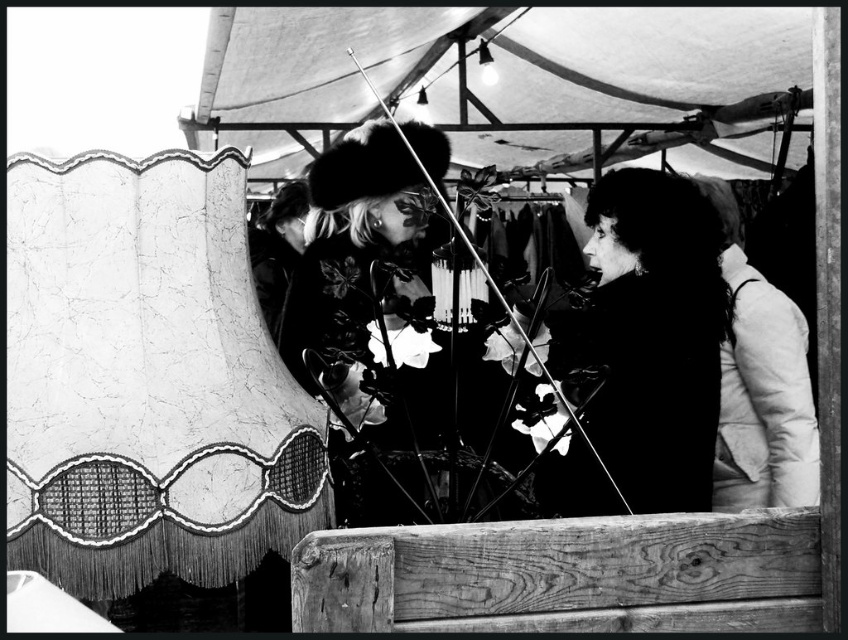
You are standing in the tent and want to touch both the white fabric canopy at upper center and the silky black hair at center. Which object should you reach for first?

You should reach for the white fabric canopy at upper center first because it is closer to you than the silky black hair at center.

You are standing in the tent and want to touch both the white fabric canopy at upper center and the white puffy jacket at right. Which object will you reach first?

The white fabric canopy at upper center is closer to you than the white puffy jacket at right, so you will reach the white fabric canopy at upper center first.

You are standing in the tent and want to move from point A to point B. Point A is at coordinates point [759,144] and point B is at coordinates point [738,240]. Which point is closer to you?

Point A at coordinates point [759,144] is closer to you because it is further to the viewer than point B at coordinates point [738,240].